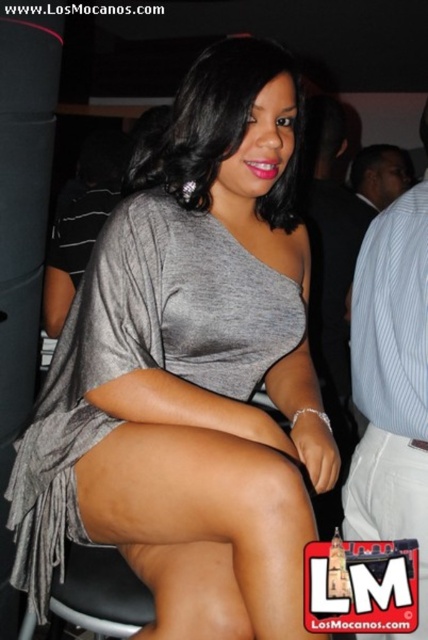
You are a photographer trying to capture a candid shot of the woman in the gray asymmetrical dress. You notice the light blue striped shirt at right and the white cotton shorts at lower right in the background. Which item is bigger in size?

The light blue striped shirt at right has a larger size compared to the white cotton shorts at lower right, so the light blue striped shirt at right is bigger in size.

You are a photographer trying to capture a candid shot of the light blue striped shirt at right and the white cotton shorts at lower right in the image. Given that your camera has a minimum focus distance of 3 inches, will you be able to focus on both items simultaneously?

The light blue striped shirt at right and white cotton shorts at lower right are 2.97 inches apart, which is less than the camera minimum focus distance of 3 inches. Therefore, you cannot focus on both items simultaneously.

Consider the image. You are a photographer trying to capture a candid shot of the woman in the gray matte dress at center and the man in the light blue striped shirt at right. The camera you are using has a maximum focus range of 12 inches. Can you focus on both subjects simultaneously?

The gray matte dress at center is 12.48 inches away from the light blue striped shirt at right. Since the distance between them exceeds the camera maximum focus range of 12 inches, you cannot focus on both subjects simultaneously.